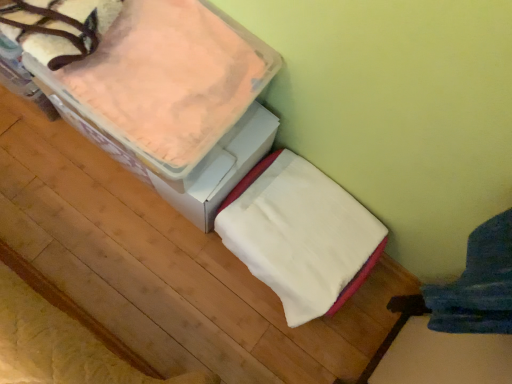
Question: In terms of height, does pink fleece blanket at upper left look taller or shorter compared to white soft blanket at center?

Choices:
 (A) tall
 (B) short

Answer: (B)

Question: From the image's perspective, is pink fleece blanket at upper left above or below white soft blanket at center?

Choices:
 (A) above
 (B) below

Answer: (A)

Question: Is point (166, 41) positioned closer to the camera than point (339, 203)?

Choices:
 (A) farther
 (B) closer

Answer: (B)

Question: From a real-world perspective, is white soft blanket at center above or below pink fleece blanket at upper left?

Choices:
 (A) below
 (B) above

Answer: (A)

Question: Would you say white soft blanket at center is to the left or to the right of pink fleece blanket at upper left in the picture?

Choices:
 (A) left
 (B) right

Answer: (B)

Question: From the image's perspective, is white soft blanket at center positioned above or below pink fleece blanket at upper left?

Choices:
 (A) above
 (B) below

Answer: (B)

Question: Is white soft blanket at center in front of or behind pink fleece blanket at upper left in the image?

Choices:
 (A) behind
 (B) front

Answer: (A)